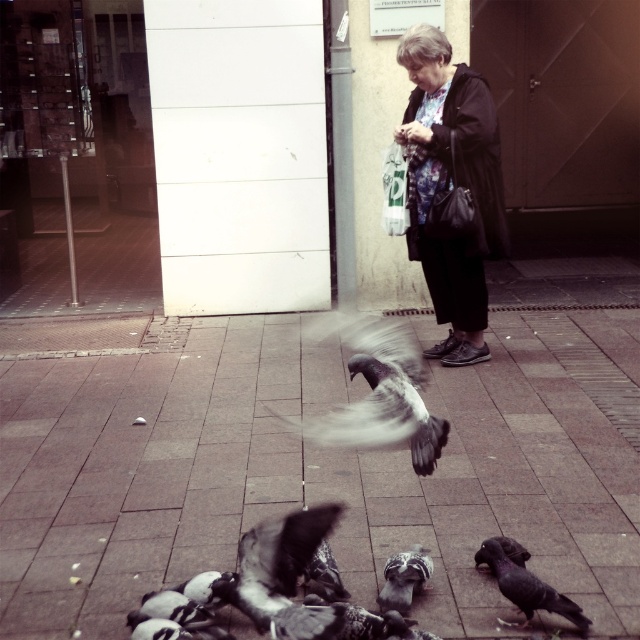
You are a photographer trying to capture the gray feathered bird at center without the brick pavement at center blocking the view. Is the bird currently positioned in a way that allows you to take a clear photo?

The gray feathered bird at center is behind the brick pavement at center, so it would be blocked by the pavement, making it difficult to take a clear photo without obstruction.

In the scene shown: You are a photographer trying to capture a photo of the gray feathered bird at center and the black feathered pigeon at lower right. Which bird is located to the left of the other?

The gray feathered bird at center is positioned on the left side of black feathered pigeon at lower right.